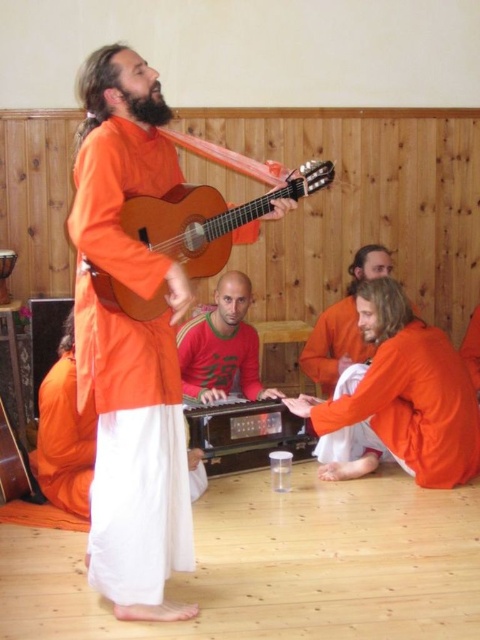
You are a photographer trying to capture the musician in the center. The orange cotton robe at center and the wooden acoustic guitar at center are both in your view. Which object is closer to the camera?

The orange cotton robe at center is in front of the wooden acoustic guitar at center, so the orange cotton robe at center is closer to the camera.

You are a photographer taking a photo of the orange cotton robe at center and the wooden acoustic guitar at center. Which object should you focus on first if you want to capture both in sharp focus?

The orange cotton robe at center is located below the wooden acoustic guitar at center. Since they are at the same center position but different vertical levels, you can focus on either one as the depth of field will likely capture both sharply if focused on the middle area between them.